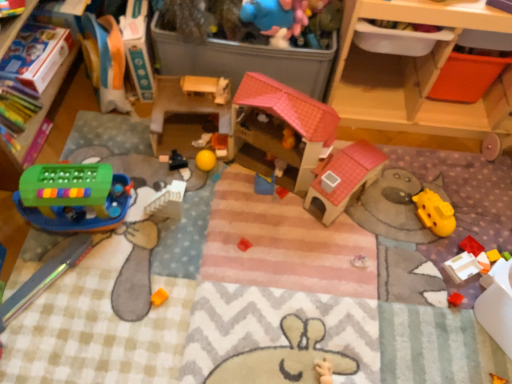
The width and height of the screenshot is (512, 384). I want to click on free point to the left of metallic blue car at center, which appears as the 8th toy when viewed from the right, so click(130, 159).